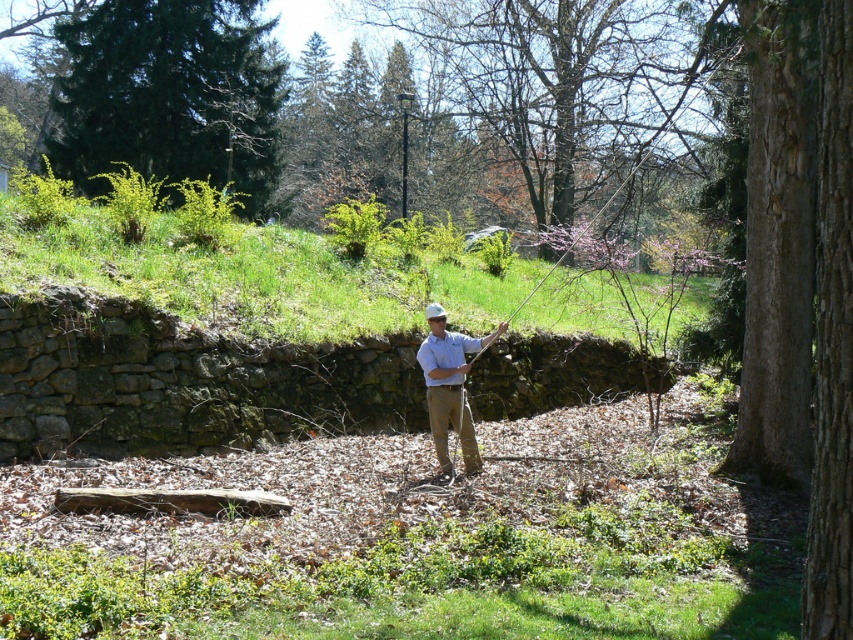
Please provide the 2D coordinates of the bare branches at upper center in the image. The answer should be in the format of a point with two decimal places, like this example format for a point at 0.128, 0.662 would be written as 0.13, 0.66.

The 2D coordinates of the bare branches at upper center are at point (561, 83).

You are a painter standing in the park and want to paint the scene. You notice the bare branches at upper center and the light blue shirt at center. Which object should you paint first if you follow the rule of painting taller objects before shorter ones?

The bare branches at upper center should be painted first because they are taller than the light blue shirt at center.

Consider the image. You are standing in the park and see the bare branches at upper center and the green textured evergreen tree at upper left. Which object is closer to you?

The bare branches at upper center is closer to you because it is in front of the green textured evergreen tree at upper left.